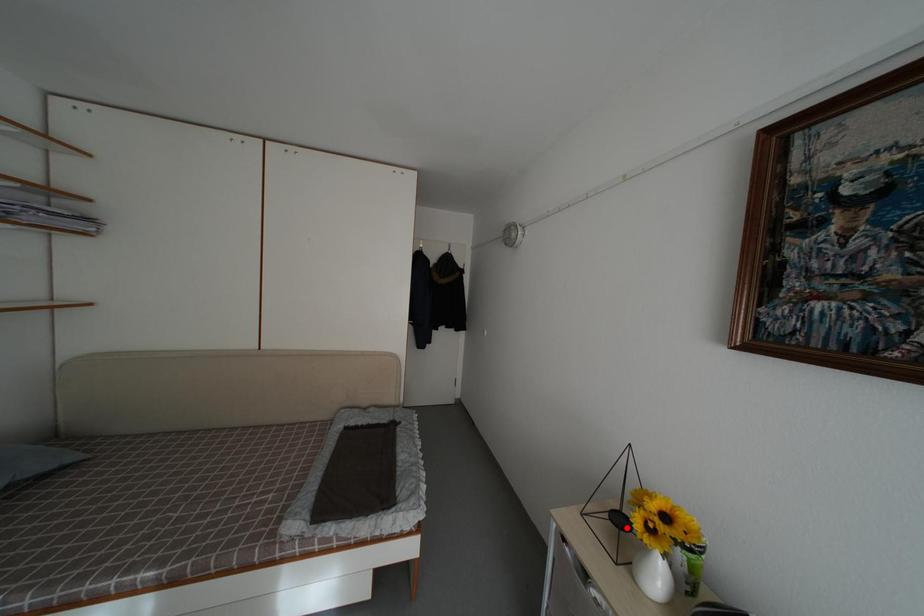
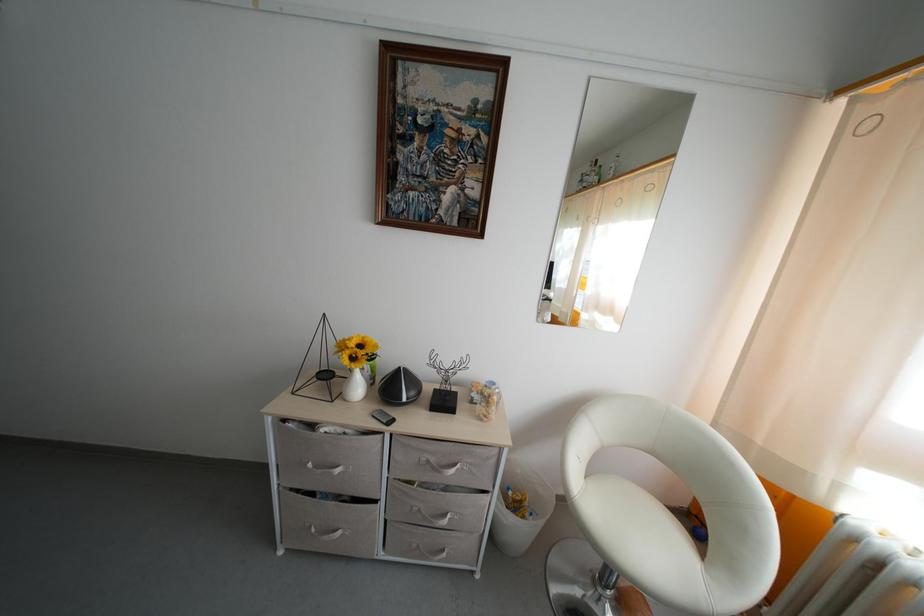
Question: I am providing you with two images of the same scene from different viewpoints. Given a red point in image1, look at the same physical point in image2. Is it:

Choices:
 (A) Closer to the viewpoint
 (B) Farther from the viewpoint

Answer: (B)